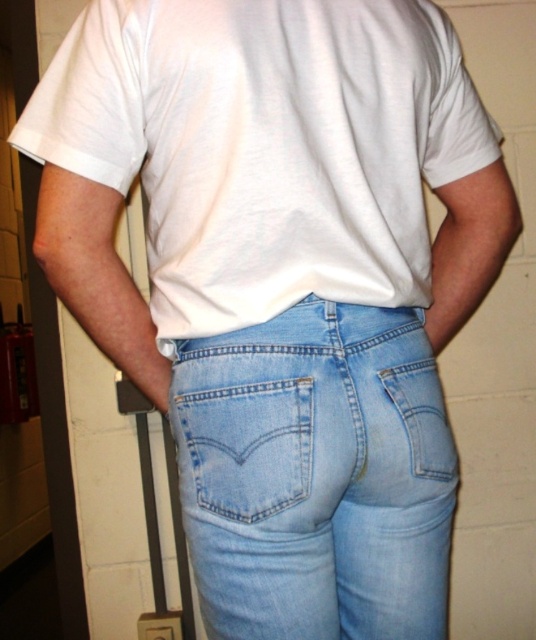
Is light blue denim jeans at center in front of light blue denim pocket at center?

No, light blue denim jeans at center is further to the viewer.

Which is behind, point (438, 381) or point (229, 452)?

The point (438, 381) is behind.

Who is more forward, (217, 493) or (236, 460)?

Point (236, 460)

At what (x,y) coordinates should I click in order to perform the action: click on light blue denim jeans at center. Please return your answer as a coordinate pair (x, y). Looking at the image, I should click on tap(316, 476).

Consider the image. Is light blue denim pocket at center closer to the viewer compared to light blue denim pocket at lower center?

Yes, it is in front of light blue denim pocket at lower center.

Can you confirm if light blue denim pocket at center is positioned to the right of light blue denim pocket at lower center?

Incorrect, light blue denim pocket at center is not on the right side of light blue denim pocket at lower center.

Is point (281, 460) positioned before point (435, 460)?

That is True.

At what (x,y) coordinates should I click in order to perform the action: click on light blue denim pocket at center. Please return your answer as a coordinate pair (x, y). Image resolution: width=536 pixels, height=640 pixels. Looking at the image, I should click on (242, 444).

Is light blue denim jeans at center to the right of light blue denim pocket at lower center from the viewer's perspective?

Incorrect, light blue denim jeans at center is not on the right side of light blue denim pocket at lower center.

Between point (228, 532) and point (426, 397), which one is positioned behind?

Point (426, 397)

Locate an element on the screen. This screenshot has width=536, height=640. light blue denim jeans at center is located at coordinates (316, 476).